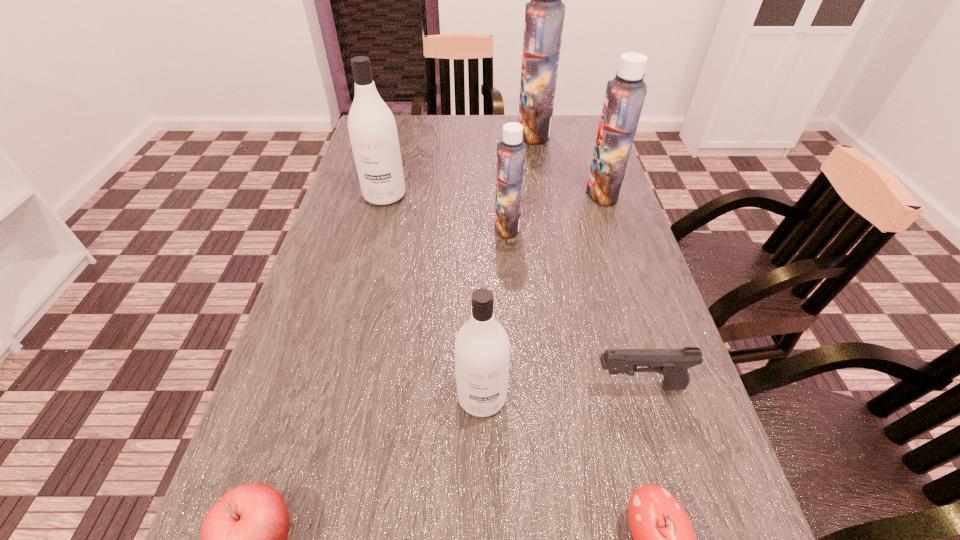
Identify which shampoo is the nearest to the rightmost shampoo. Please provide its 2D coordinates. Your answer should be formatted as a tuple, i.e. [(x, y)], where the tuple contains the x and y coordinates of a point satisfying the conditions above.

[(544, 15)]

What are the coordinates of `blue shampoo that is the third nearest to the right white shampoo` in the screenshot? It's located at (544, 15).

Point out which blue shampoo is positioned as the nearest to the leftmost shampoo. Please provide its 2D coordinates. Your answer should be formatted as a tuple, i.e. [(x, y)], where the tuple contains the x and y coordinates of a point satisfying the conditions above.

[(511, 152)]

Where is `free space that satisfies the following two spatial constraints: 1. on the front label of the leftmost blue shampoo; 2. on the front-facing side of the nearer white shampoo`? free space that satisfies the following two spatial constraints: 1. on the front label of the leftmost blue shampoo; 2. on the front-facing side of the nearer white shampoo is located at coordinates (518, 397).

Find the location of `vacant region that satisfies the following two spatial constraints: 1. on the front label of the farthest shampoo; 2. on the front-facing side of the nearer white shampoo`. vacant region that satisfies the following two spatial constraints: 1. on the front label of the farthest shampoo; 2. on the front-facing side of the nearer white shampoo is located at coordinates (580, 397).

At what (x,y) coordinates should I click in order to perform the action: click on free location that satisfies the following two spatial constraints: 1. on the front label of the rightmost shampoo; 2. on the front-facing side of the nearest shampoo. Please return your answer as a coordinate pair (x, y). Looking at the image, I should click on (670, 397).